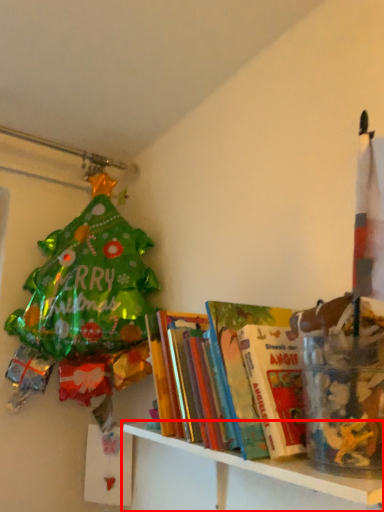
Question: From the image, what is the correct spatial relationship of shelf (annotated by the red box) in relation to shelf?

Choices:
 (A) right
 (B) left

Answer: (A)